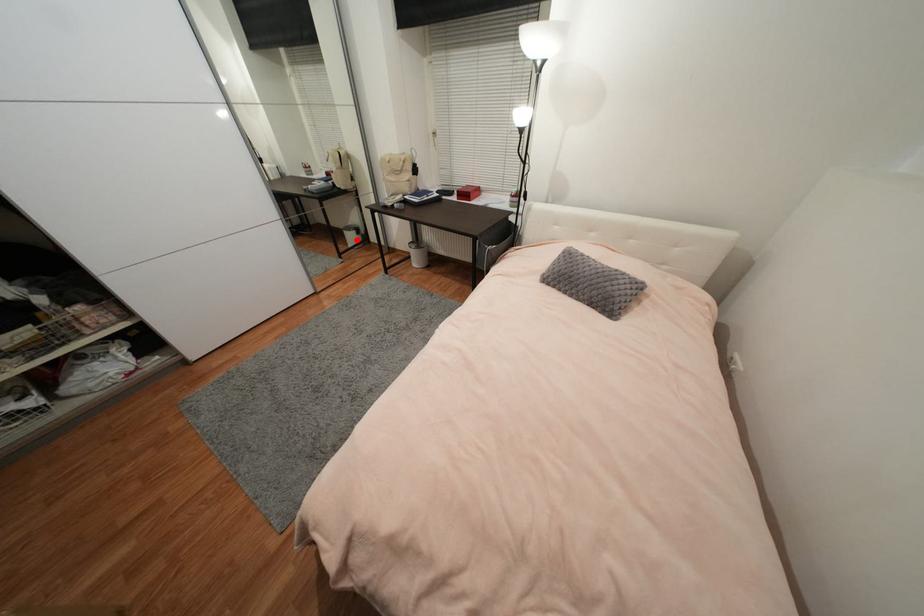
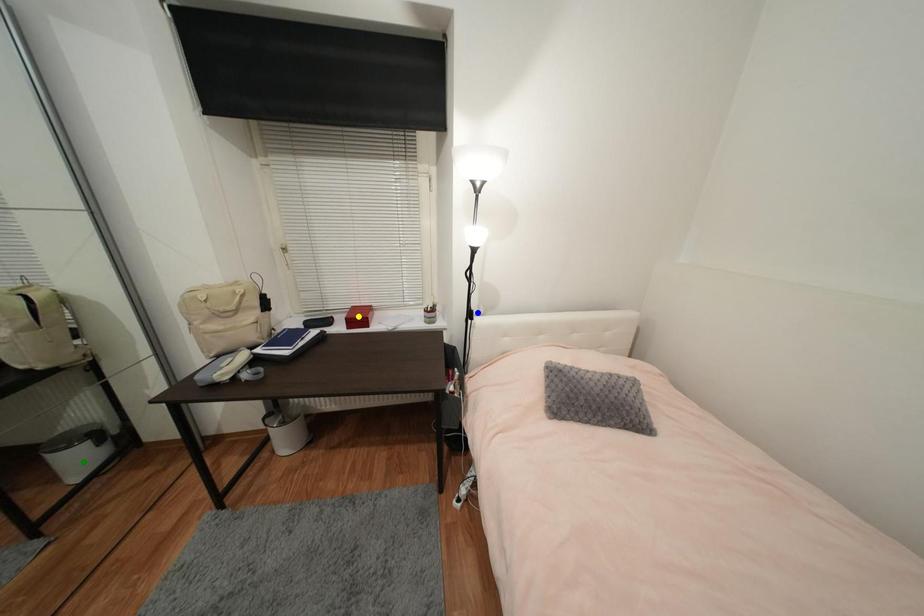
Question: I am providing you with two images of the same scene from different viewpoints. A red point is marked on the first image. You are given multiple points on the second image. Which spot in image 2 lines up with the point in image 1?

Choices:
 (A) blue point
 (B) green point
 (C) yellow point

Answer: (B)